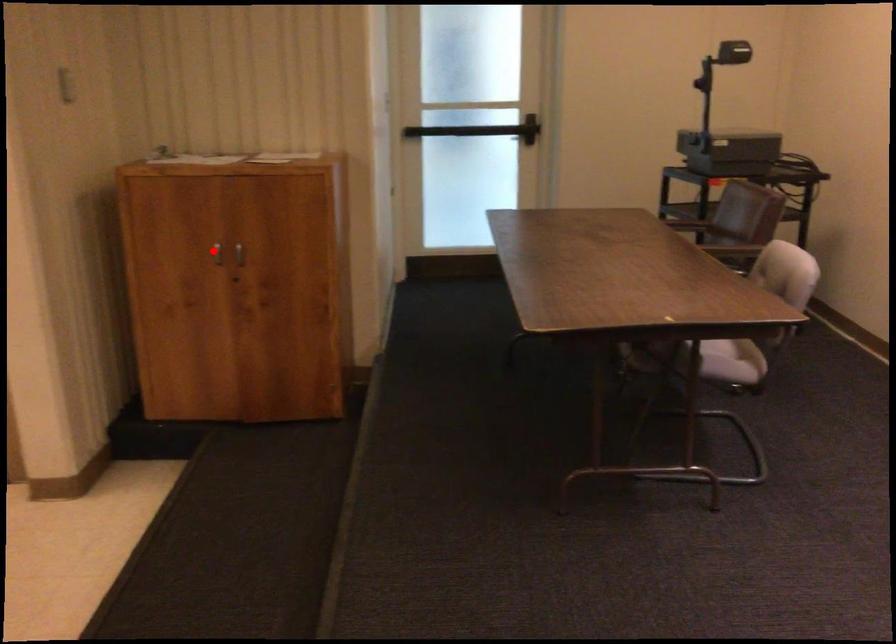
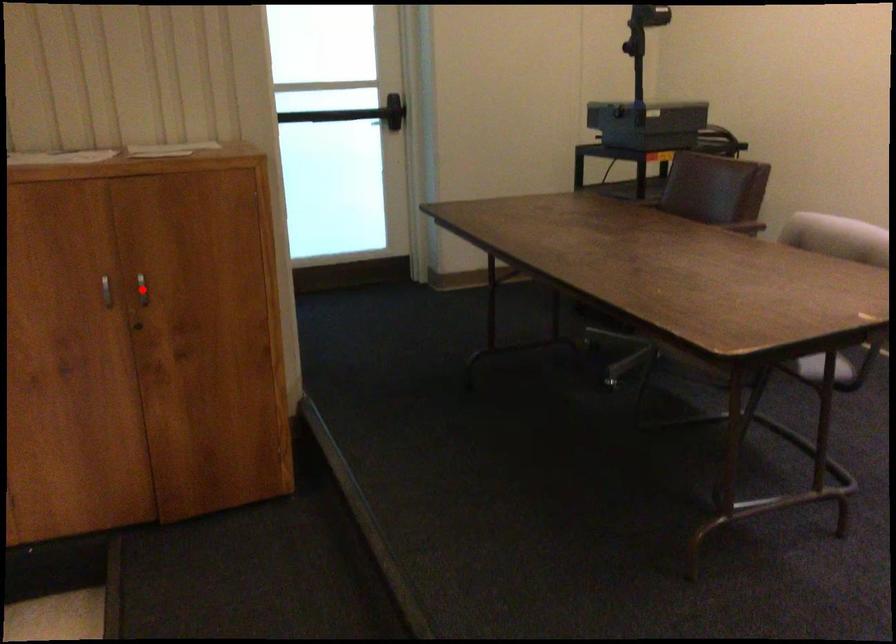
I am providing you with two images of the same scene from different viewpoints. A red point is marked on the first image and another point is marked on the second image. Do the highlighted points in image1 and image2 indicate the same real-world spot?

No